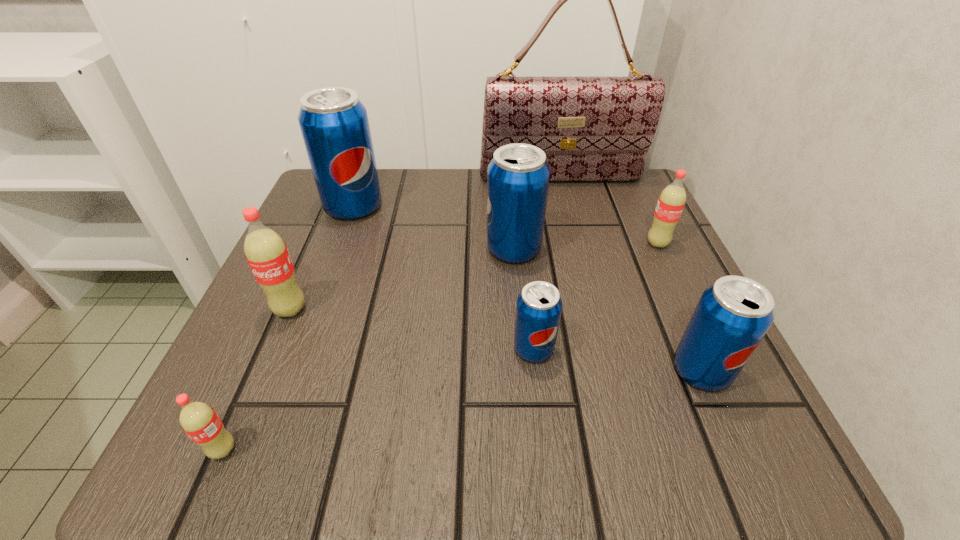
The height and width of the screenshot is (540, 960). In order to click on vacant space located 0.320m on the back of the smallest red soda in this screenshot , I will do `click(302, 269)`.

Image resolution: width=960 pixels, height=540 pixels. In order to click on handbag located in the far edge section of the desktop in this screenshot , I will do `click(591, 128)`.

Locate an element on the screen. This screenshot has height=540, width=960. pop soda located in the far edge section of the desktop is located at coordinates (334, 123).

Identify the location of object present at the near edge. (198, 420).

I want to click on handbag at the right edge, so click(x=591, y=128).

The width and height of the screenshot is (960, 540). I want to click on object at the far left corner, so point(334,123).

This screenshot has width=960, height=540. In order to click on object that is at the near left corner in this screenshot , I will do `click(198, 420)`.

Identify the location of object located at the far right corner. The image size is (960, 540). (591, 128).

This screenshot has width=960, height=540. Find the location of `free region at the far edge of the desktop`. free region at the far edge of the desktop is located at coordinates coord(398,210).

Where is `blank space at the near edge of the desktop`? Image resolution: width=960 pixels, height=540 pixels. blank space at the near edge of the desktop is located at coordinates (523, 421).